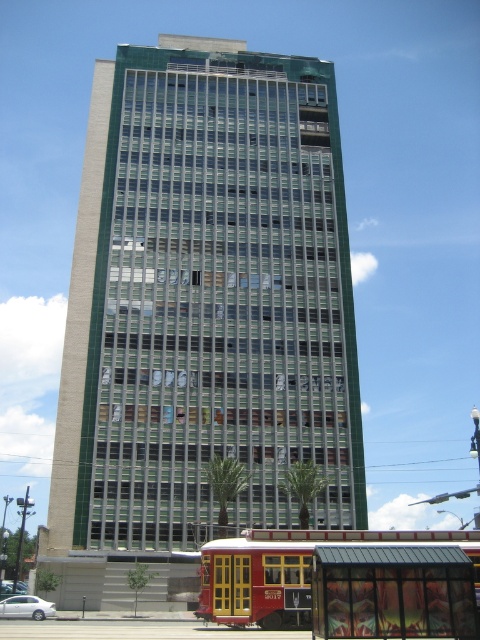
You are standing at the origin point of a coordinate system where the bottom left corner of the image is the origin. The green glass building at center is located at coordinates approximately where?

The green glass building at center is located at coordinates approximately point (204, 307).

You are a delivery person needing to park your vehicle between the red polished wood bus at lower center and the white matte car at lower left. Your vehicle is 2 meters wide. Can you fit your vehicle in the available space between them?

The red polished wood bus at lower center is wider than the white matte car at lower left. However, the exact width of the space between them isn

You are a passenger waiting at the metallic glass bus stop at lower center and want to board the red polished wood bus at lower center. Can you tell me if you can easily reach the bus from your current position?

The metallic glass bus stop at lower center is smaller than the red polished wood bus at lower center, so yes, you can easily reach the bus from the bus stop since the bus is larger and closer in proximity.